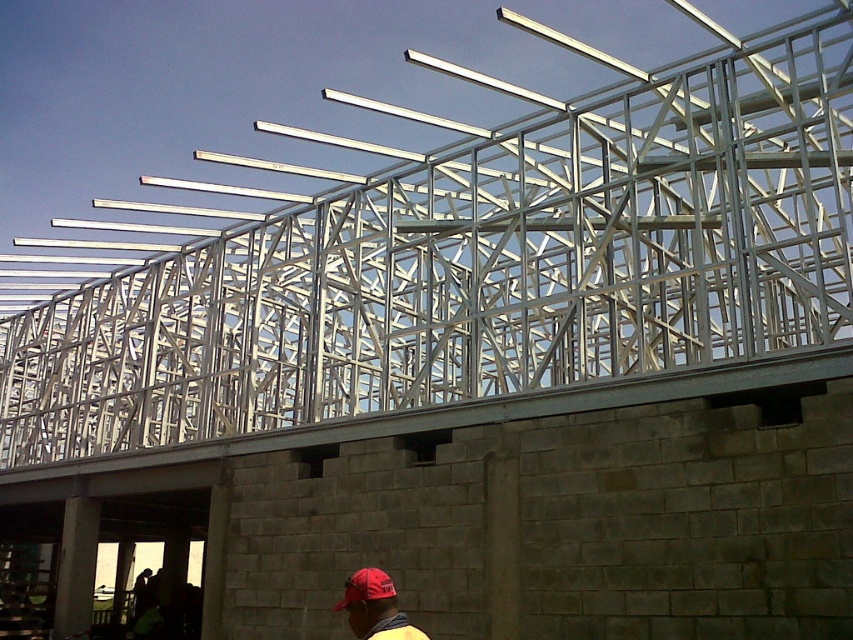
Does matte red cap at lower center appear on the left side of red matte baseball cap at lower center?

A: No, matte red cap at lower center is not to the left of red matte baseball cap at lower center.

Find the location of a particular element. Image resolution: width=853 pixels, height=640 pixels. matte red cap at lower center is located at coordinates (374, 608).

Identify the location of matte red cap at lower center. (374, 608).